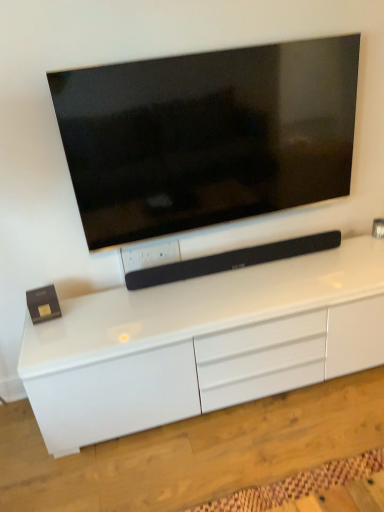
Question: Considering the relative positions of white glossy cabinet at center and matte black tv at upper center in the image provided, is white glossy cabinet at center to the left of matte black tv at upper center from the viewer's perspective?

Choices:
 (A) yes
 (B) no

Answer: (B)

Question: Does white glossy cabinet at center lie behind matte black tv at upper center?

Choices:
 (A) yes
 (B) no

Answer: (B)

Question: From the image's perspective, is white glossy cabinet at center over matte black tv at upper center?

Choices:
 (A) yes
 (B) no

Answer: (B)

Question: Is white glossy cabinet at center not within matte black tv at upper center?

Choices:
 (A) no
 (B) yes

Answer: (B)

Question: From the image's perspective, is white glossy cabinet at center under matte black tv at upper center?

Choices:
 (A) yes
 (B) no

Answer: (A)

Question: Is white glossy cabinet at center next to matte black tv at upper center?

Choices:
 (A) yes
 (B) no

Answer: (B)

Question: Considering the relative sizes of black matte soundbar at center and matte black tv at upper center in the image provided, is black matte soundbar at center wider than matte black tv at upper center?

Choices:
 (A) yes
 (B) no

Answer: (A)

Question: Is black matte soundbar at center oriented away from matte black tv at upper center?

Choices:
 (A) yes
 (B) no

Answer: (B)

Question: Is black matte soundbar at center located outside matte black tv at upper center?

Choices:
 (A) no
 (B) yes

Answer: (B)

Question: Could matte black tv at upper center be considered to be inside black matte soundbar at center?

Choices:
 (A) yes
 (B) no

Answer: (B)

Question: Does black matte soundbar at center touch matte black tv at upper center?

Choices:
 (A) yes
 (B) no

Answer: (B)

Question: Does black matte soundbar at center have a lesser width compared to matte black tv at upper center?

Choices:
 (A) no
 (B) yes

Answer: (A)

Question: Does matte black tv at upper center lie behind white glossy cabinet at center?

Choices:
 (A) no
 (B) yes

Answer: (B)